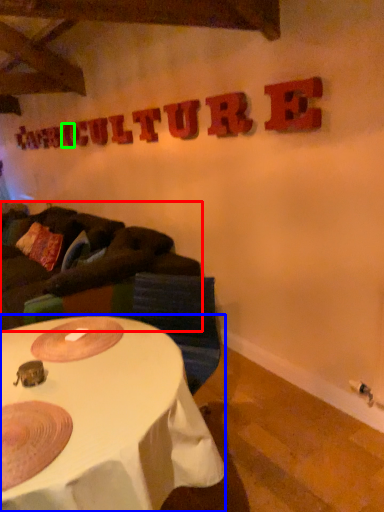
Question: Considering the real-world distances, which object is closest to studio couch (highlighted by a red box)? table (highlighted by a blue box) or letter (highlighted by a green box).

Choices:
 (A) table
 (B) letter

Answer: (A)